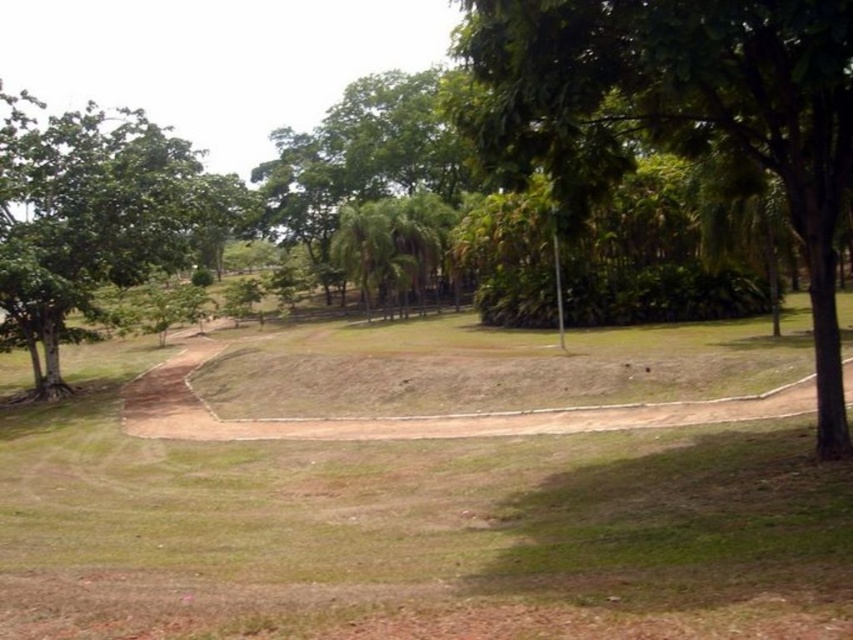
Question: Can you confirm if green leafy tree at center is positioned to the left of green leafy tree at left?

Choices:
 (A) no
 (B) yes

Answer: (A)

Question: Which object is closer to the camera taking this photo?

Choices:
 (A) green leafy tree at left
 (B) green leafy tree at center

Answer: (B)

Question: Can you confirm if green leafy tree at center is positioned to the left of green leafy tree at left?

Choices:
 (A) yes
 (B) no

Answer: (B)

Question: Does green leafy tree at center have a smaller size compared to green leafy tree at left?

Choices:
 (A) yes
 (B) no

Answer: (A)

Question: Which point is closer to the camera?

Choices:
 (A) (143, 272)
 (B) (459, 33)

Answer: (B)